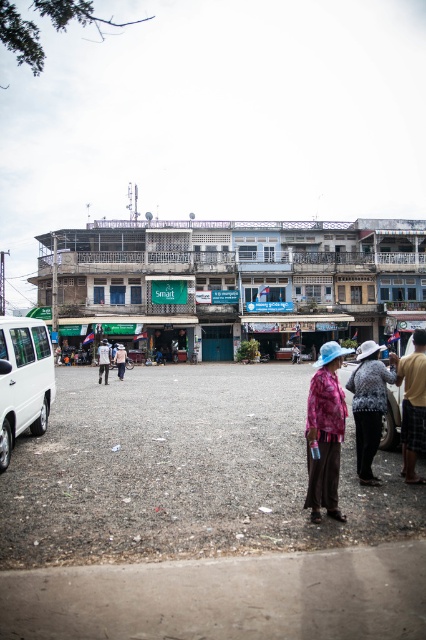
Is printed fabric pants at center smaller than light pink fabric hat at center?

Yes, printed fabric pants at center is smaller than light pink fabric hat at center.

Is point (325, 392) closer to camera compared to point (121, 346)?

Yes, point (325, 392) is in front of point (121, 346).

Does point (322, 484) lie behind point (126, 356)?

No, it is in front of (126, 356).

Image resolution: width=426 pixels, height=640 pixels. Find the location of `printed fabric pants at center`. printed fabric pants at center is located at coordinates (325, 433).

Which is below, patterned fabric dress at lower right or brown woven hat at right?

patterned fabric dress at lower right

Which is in front, point (365, 372) or point (403, 406)?

Point (365, 372) is more forward.

Locate an element on the screen. patterned fabric dress at lower right is located at coordinates (368, 406).

Which is in front, point (313, 509) or point (374, 444)?

Point (313, 509)

Is point (328, 467) behind point (371, 381)?

No, (328, 467) is in front of (371, 381).

Is point (316, 368) positioned before point (368, 445)?

Yes.

Locate an element on the screen. The width and height of the screenshot is (426, 640). printed fabric pants at center is located at coordinates pos(325,433).